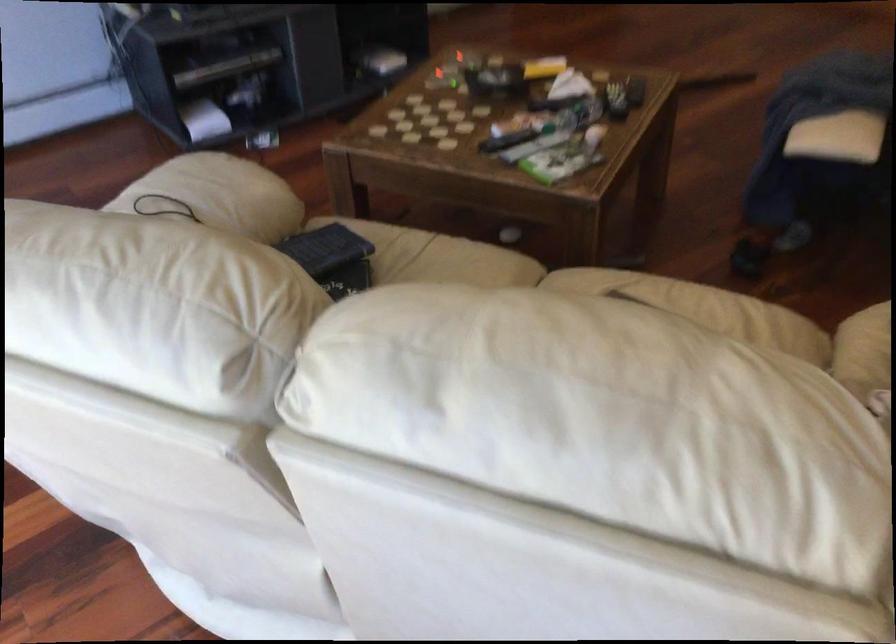
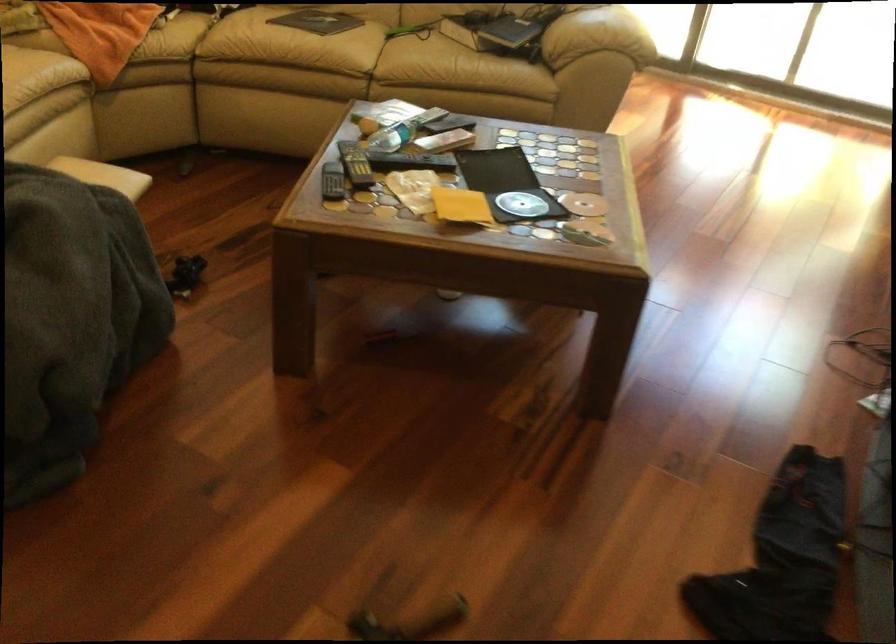
In the second image, find the point that corresponds to pixel 615 88 in the first image.

(355, 164)